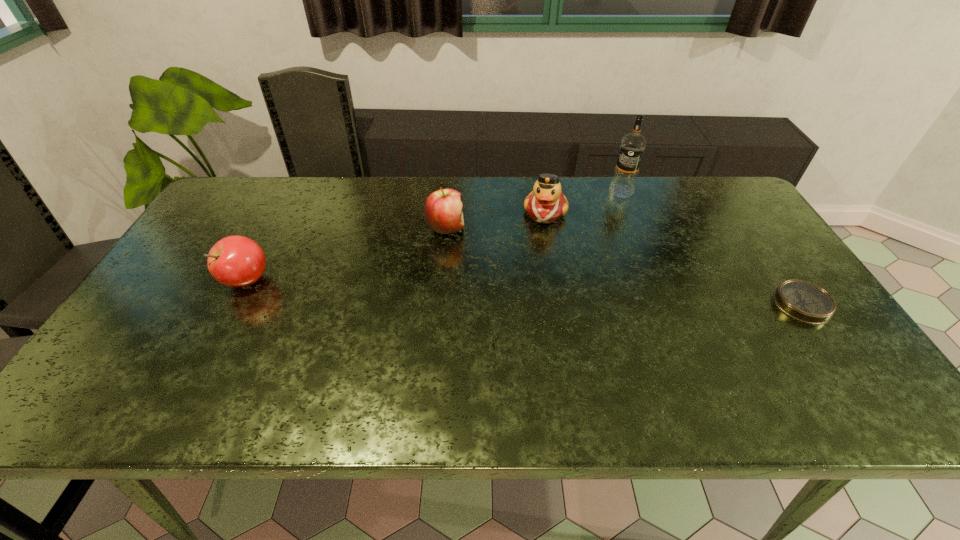
You are a GUI agent. You are given a task and a screenshot of the screen. Output one action in this format:
    pyautogui.click(x=<x>, y=<y>)
    Task: Click on the empty space that is in between the farther apple and the shortest object
    
    Given the screenshot: What is the action you would take?
    pyautogui.click(x=624, y=266)

The height and width of the screenshot is (540, 960). Find the location of `vacant point located between the shortest object and the second object from right to left`. vacant point located between the shortest object and the second object from right to left is located at coordinates (711, 248).

Find the location of a particular element. The height and width of the screenshot is (540, 960). free space between the compass and the nearer apple is located at coordinates (524, 292).

This screenshot has height=540, width=960. Find the location of `vacant area that lies between the third object from right to left and the second object from right to left`. vacant area that lies between the third object from right to left and the second object from right to left is located at coordinates (583, 202).

The image size is (960, 540). Find the location of `vacant area that lies between the duck and the farther apple`. vacant area that lies between the duck and the farther apple is located at coordinates (495, 220).

Where is `free space that is in between the third object from right to left and the compass`? free space that is in between the third object from right to left and the compass is located at coordinates (674, 258).

At what (x,y) coordinates should I click in order to perform the action: click on free spot between the third object from left to right and the rightmost object. Please return your answer as a coordinate pair (x, y). The width and height of the screenshot is (960, 540). Looking at the image, I should click on (674, 258).

The height and width of the screenshot is (540, 960). Identify the location of free area in between the right apple and the rightmost object. (624, 266).

I want to click on empty space between the compass and the second object from right to left, so click(x=711, y=248).

I want to click on free area in between the leftmost object and the tallest object, so pyautogui.click(x=434, y=236).